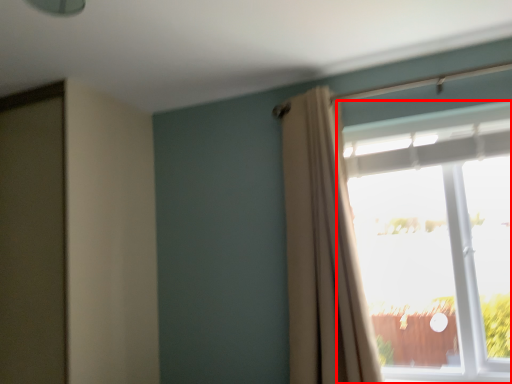
Question: In this image, where is window (annotated by the red box) located relative to curtain?

Choices:
 (A) right
 (B) left

Answer: (A)